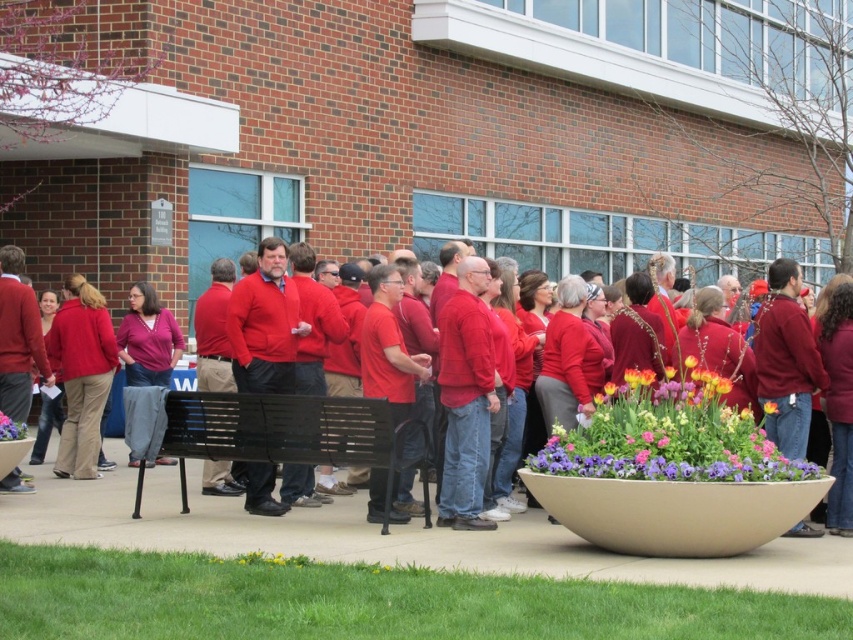
Which of these two, matte red sweater at center or purple matte flower at lower center, stands shorter?

purple matte flower at lower center

Is point (149, 416) farther from camera compared to point (12, 440)?

That is False.

Measure the distance between point (451,472) and camera.

A distance of 9.94 meters exists between point (451,472) and camera.

The height and width of the screenshot is (640, 853). I want to click on matte red sweater at center, so click(x=257, y=426).

Which is more to the right, black metal bench at lower center or yellow matte flower at center?

From the viewer's perspective, yellow matte flower at center appears more on the right side.

I want to click on black metal bench at lower center, so click(280, 432).

Between black metal bench at lower center and purple matte flower at lower center, which one has more height?

black metal bench at lower center

Who is more distant from viewer, [368,438] or [16,435]?

Point [16,435]

At what (x,y) coordinates should I click in order to perform the action: click on black metal bench at lower center. Please return your answer as a coordinate pair (x, y). Looking at the image, I should click on tap(280, 432).